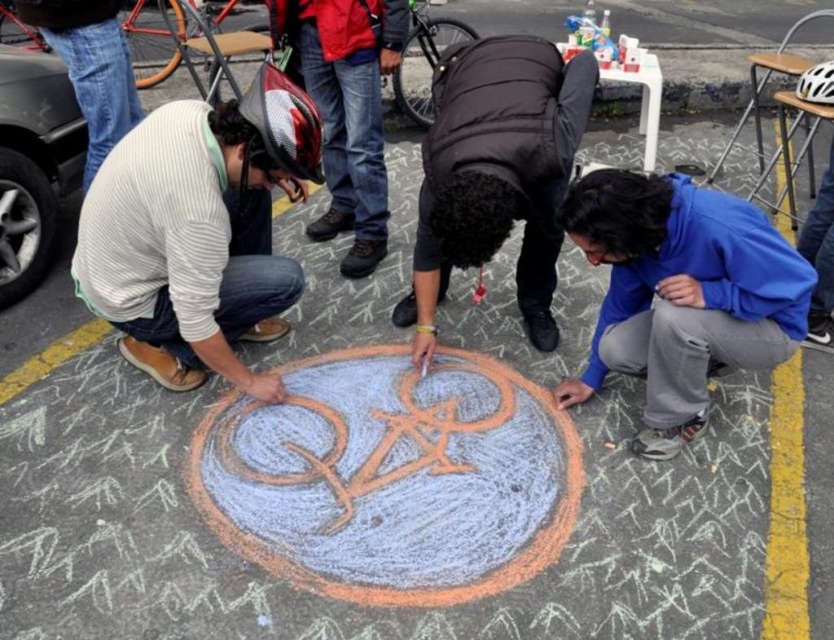
You are standing in the scene and want to reach both the point at coordinates point (93,262) and point (671,316). Which point should you walk towards first to reach them in the shortest path?

You should walk towards point (93,262) first because it is closer to you than point (671,316), which is further away.

Based on the scene description, where is the striped sweater at left located in terms of coordinates?

The striped sweater at left is located at coordinates point (197, 230).

You are standing at the point labeled point [446,81] and want to walk to the point labeled point [666,372]. Which direction should you face to move towards your destination?

You should face forward because point [666,372] is in front of point [446,81].